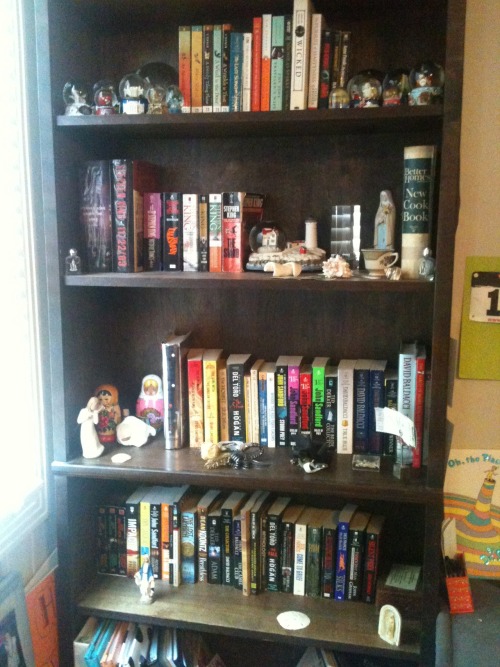
The width and height of the screenshot is (500, 667). I want to click on snow globes, so click(x=434, y=77), click(x=398, y=87), click(x=369, y=87), click(x=339, y=101), click(x=276, y=233), click(x=177, y=103), click(x=160, y=97), click(x=134, y=89), click(x=102, y=95), click(x=70, y=103).